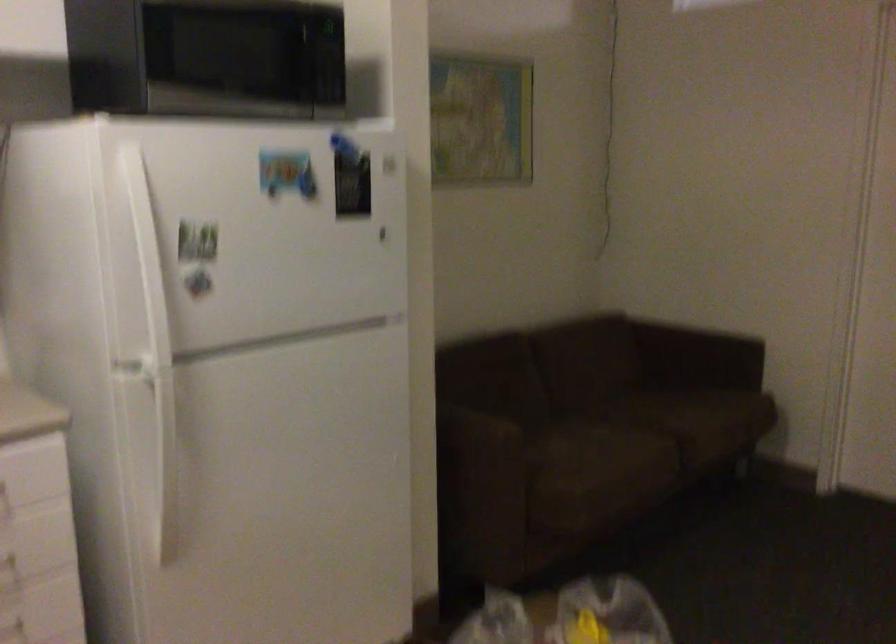
Describe the element at coordinates (487, 471) in the screenshot. I see `a sofa armrest` at that location.